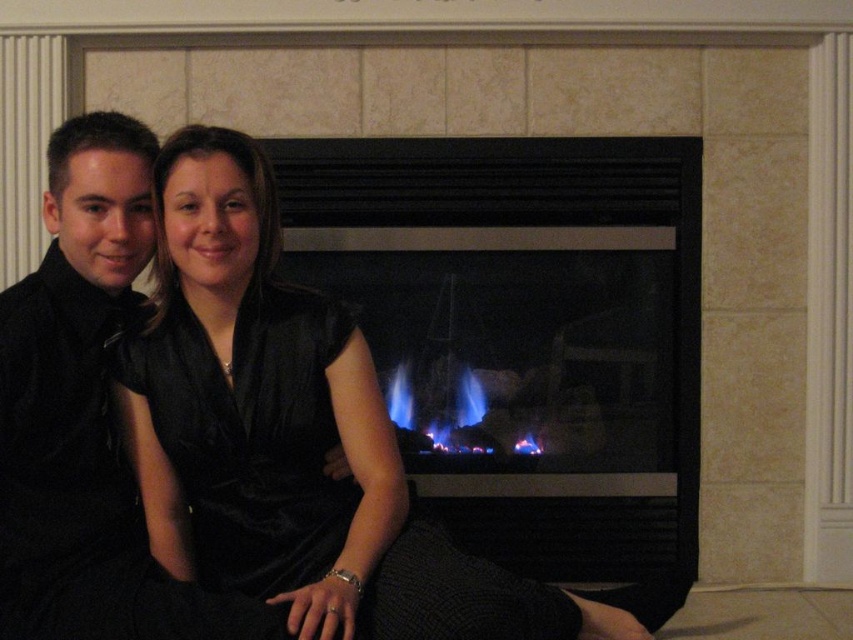
Question: In this image, where is blue glass fireplace at center located relative to velvet black dress at center?

Choices:
 (A) below
 (B) above

Answer: (B)

Question: Which point appears farthest from the camera in this image?

Choices:
 (A) (78, 234)
 (B) (540, 588)

Answer: (B)

Question: Among these objects, which one is farthest from the camera?

Choices:
 (A) blue flames at center
 (B) blue glass fireplace at center
 (C) velvet black dress at center

Answer: (A)

Question: Estimate the real-world distances between objects in this image. Which object is farther from the black velvet shirt at left?

Choices:
 (A) velvet black dress at center
 (B) blue flames at center

Answer: (B)

Question: Does velvet black dress at center come behind black velvet shirt at left?

Choices:
 (A) no
 (B) yes

Answer: (A)

Question: Does blue glass fireplace at center have a larger size compared to velvet black dress at center?

Choices:
 (A) yes
 (B) no

Answer: (B)